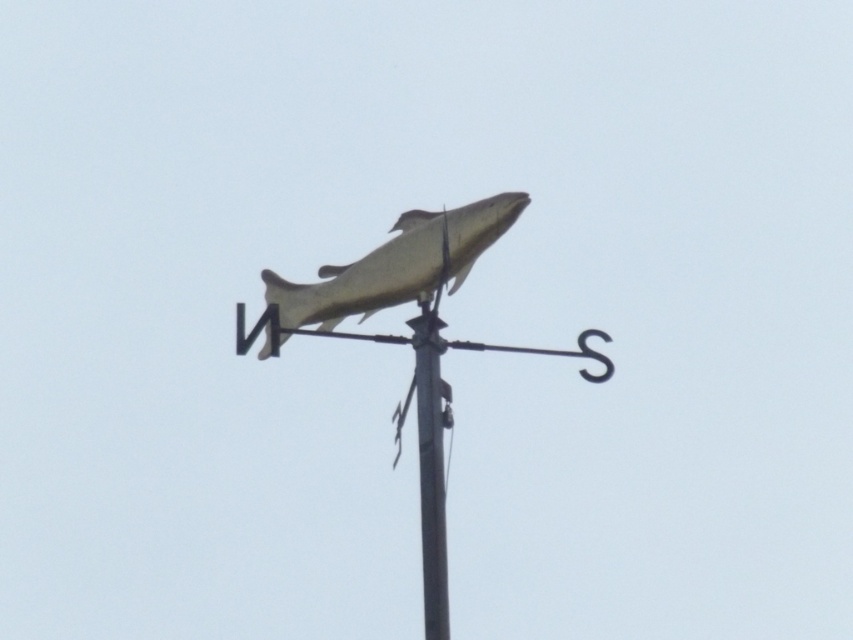
Who is more distant from viewer, (456, 266) or (378, 291)?

Positioned behind is point (378, 291).

Is metallic gold fish at upper center thinner than shiny gold fish at center?

In fact, metallic gold fish at upper center might be wider than shiny gold fish at center.

What do you see at coordinates (409, 340) in the screenshot?
I see `metallic gold fish at upper center` at bounding box center [409, 340].

Locate an element on the screen. This screenshot has width=853, height=640. metallic gold fish at upper center is located at coordinates (409, 340).

Between point (440, 548) and point (428, 538), which one is positioned behind?

The point (428, 538) is behind.

You are a GUI agent. You are given a task and a screenshot of the screen. Output one action in this format:
    pyautogui.click(x=<x>, y=<y>)
    Task: Click on the metallic gold fish at upper center
    The width and height of the screenshot is (853, 640).
    Given the screenshot: What is the action you would take?
    pos(409,340)

Which of these two, shiny gold fish at center or metallic pole at center, stands shorter?

Standing shorter between the two is shiny gold fish at center.

Can you confirm if shiny gold fish at center is positioned to the left of metallic pole at center?

Indeed, shiny gold fish at center is positioned on the left side of metallic pole at center.

Identify the location of shiny gold fish at center. The image size is (853, 640). (397, 264).